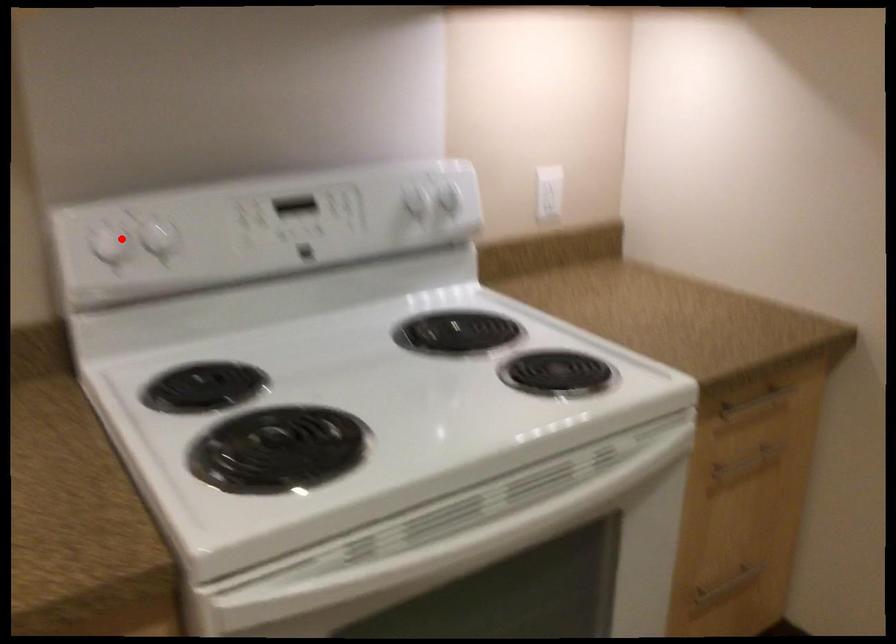
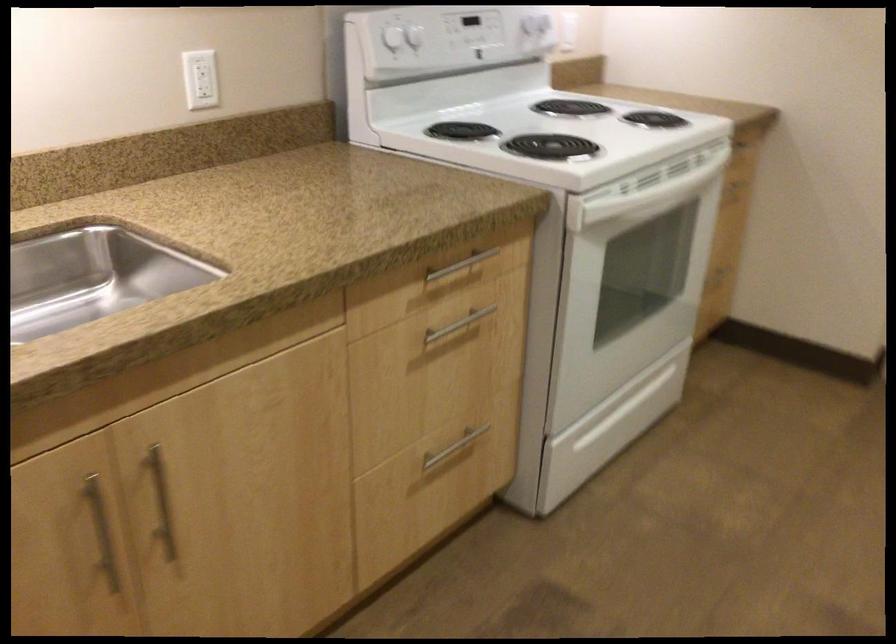
Find the pixel in the second image that matches the highlighted location in the first image.

(392, 38)